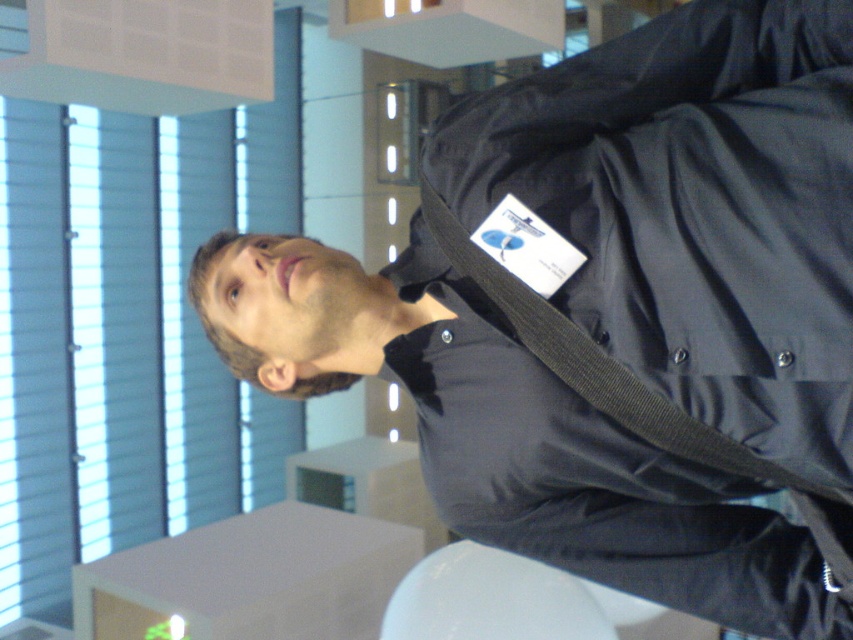
Question: Among these points, which one is nearest to the camera?

Choices:
 (A) (479, 256)
 (B) (115, 243)

Answer: (A)

Question: Which object appears farthest from the camera in this image?

Choices:
 (A) blue fabric blinds at left
 (B) black fabric strap at upper right

Answer: (A)

Question: Can you confirm if blue fabric blinds at left is positioned to the right of black fabric strap at upper right?

Choices:
 (A) no
 (B) yes

Answer: (A)

Question: Is the position of blue fabric blinds at left more distant than that of black fabric strap at upper right?

Choices:
 (A) no
 (B) yes

Answer: (B)

Question: Is blue fabric blinds at left positioned in front of black fabric strap at upper right?

Choices:
 (A) yes
 (B) no

Answer: (B)

Question: Which point is closer to the camera taking this photo?

Choices:
 (A) (434, 198)
 (B) (103, 515)

Answer: (A)